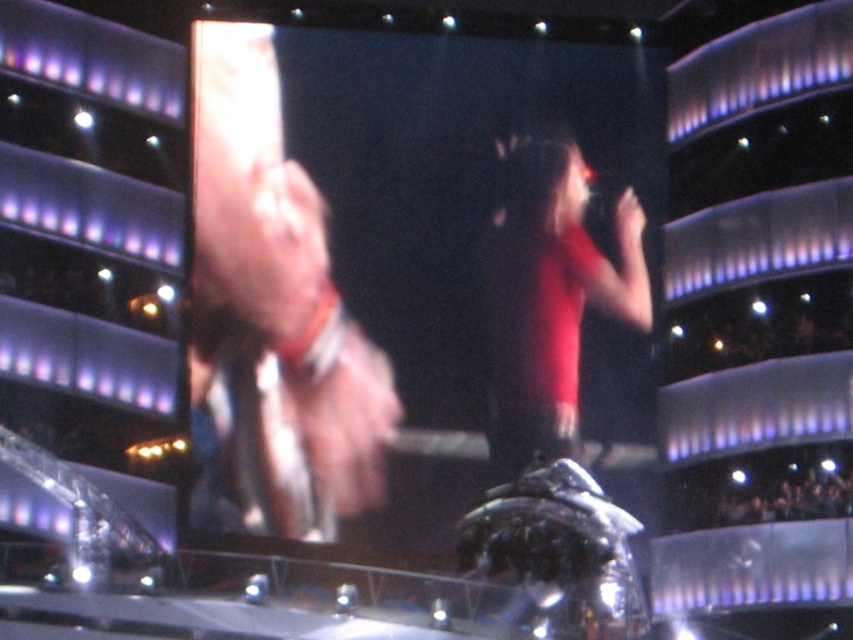
Based on the scene description, can you determine if the smooth skin hand at center is closer to the camera than the matte red shirt at center?

The smooth skin hand at center is much taller than the matte red shirt at center in the image, which suggests that the smooth skin hand at center is closer to the camera than the matte red shirt at center due to perspective effects.

You are a stagehand at the concert venue and need to ensure that the smooth skin hand at center and the matte red shirt at center are within a 15 meter safety distance for equipment placement. Are they within the required distance?

The smooth skin hand at center is 16.52 meters away from matte red shirt at center, which exceeds the 15 meter safety distance requirement. They are not within the required distance.

You are a photographer at the concert venue. You need to capture a clear photo of the matte red shirt at center without the smooth skin hand at center blocking it. Given that the hand is wider than the shirt, can you position yourself so that the hand doesn t cover the shirt?

The smooth skin hand at center is wider than the matte red shirt at center. Since the hand is wider, positioning yourself to avoid the hand blocking the shirt may be challenging, but possible by angling the camera slightly to the side where the shirt is visible beyond the hand.